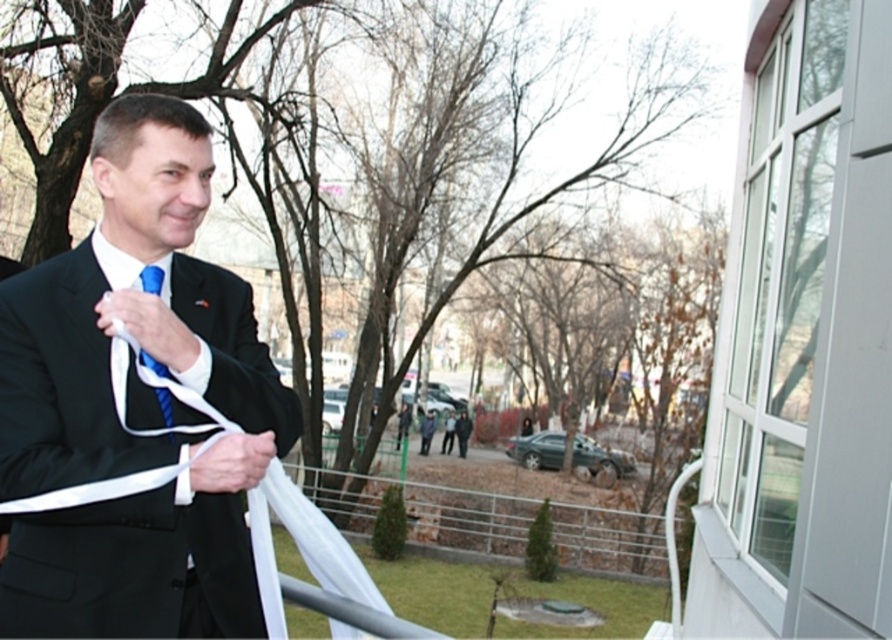
Between matte black suit at center and blue textured tie at center, which one has more height?

With more height is matte black suit at center.

Find the location of a particular element. The height and width of the screenshot is (640, 892). matte black suit at center is located at coordinates (114, 413).